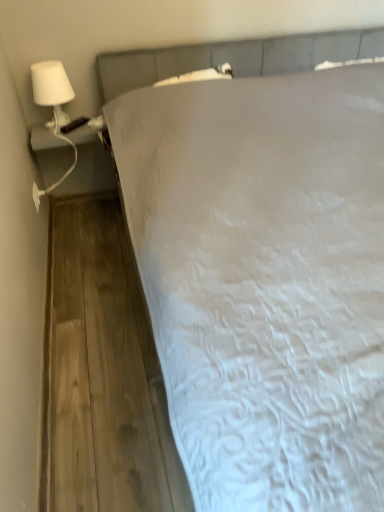
Question: Is white matte lamp at upper left smaller than white textured bed at center?

Choices:
 (A) no
 (B) yes

Answer: (B)

Question: Is white matte lamp at upper left outside of white textured bed at center?

Choices:
 (A) yes
 (B) no

Answer: (A)

Question: Does white matte lamp at upper left lie in front of white textured bed at center?

Choices:
 (A) yes
 (B) no

Answer: (B)

Question: Could white textured bed at center be considered to be inside white matte lamp at upper left?

Choices:
 (A) yes
 (B) no

Answer: (B)

Question: Considering the relative sizes of white matte lamp at upper left and white textured bed at center in the image provided, is white matte lamp at upper left shorter than white textured bed at center?

Choices:
 (A) no
 (B) yes

Answer: (B)

Question: Is white matte lamp at upper left wider than white textured bed at center?

Choices:
 (A) yes
 (B) no

Answer: (B)

Question: Is white textured bed at center next to white matte lamp at upper left and touching it?

Choices:
 (A) yes
 (B) no

Answer: (B)

Question: Is white textured bed at center positioned far away from white matte lamp at upper left?

Choices:
 (A) no
 (B) yes

Answer: (A)

Question: From a real-world perspective, is white textured bed at center beneath white matte lamp at upper left?

Choices:
 (A) yes
 (B) no

Answer: (A)

Question: Does white textured bed at center come in front of white matte lamp at upper left?

Choices:
 (A) yes
 (B) no

Answer: (A)

Question: Is white textured bed at center shorter than white matte lamp at upper left?

Choices:
 (A) yes
 (B) no

Answer: (B)

Question: From a real-world perspective, is white textured bed at center positioned over white matte lamp at upper left based on gravity?

Choices:
 (A) yes
 (B) no

Answer: (B)

Question: Is white matte lamp at upper left taller or shorter than white textured bed at center?

Choices:
 (A) short
 (B) tall

Answer: (A)